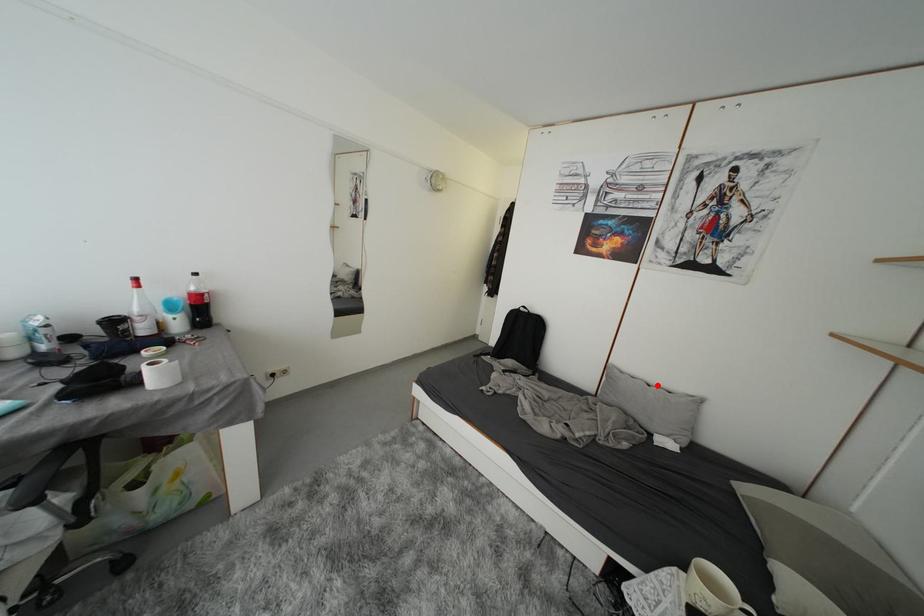
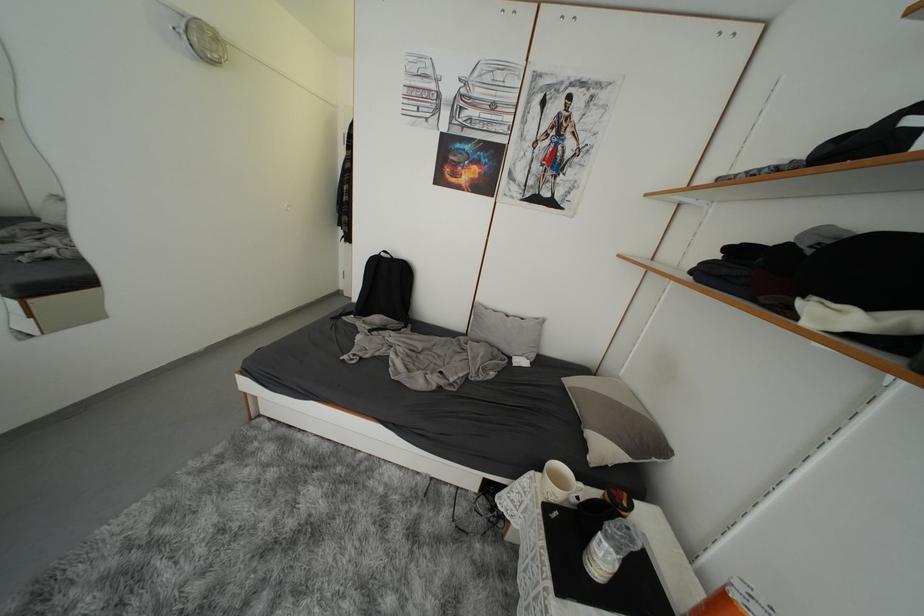
The point at the highlighted location is marked in the first image. Where is the corresponding point in the second image?

(516, 315)